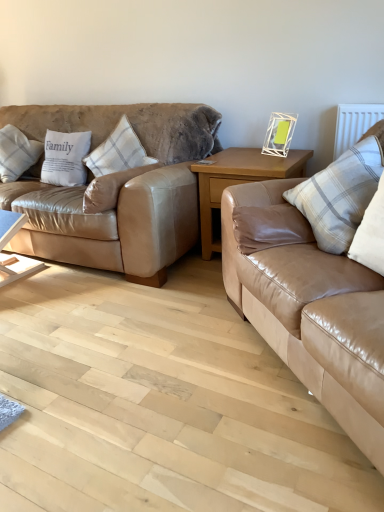
Question: Is tan leather couch at right, marked as the 2th studio couch in a left-to-right arrangement, thinner than white plaid pillow at left, which is counted as the third pillow, starting from the right?

Choices:
 (A) no
 (B) yes

Answer: (A)

Question: Would you say tan leather couch at right, marked as the 2th studio couch in a left-to-right arrangement, is outside white plaid pillow at left, the 3th pillow viewed from the left?

Choices:
 (A) no
 (B) yes

Answer: (B)

Question: Is white plaid pillow at left, the 3th pillow viewed from the left, completely or partially inside tan leather couch at right, the first studio couch positioned from the right?

Choices:
 (A) yes
 (B) no

Answer: (B)

Question: Is tan leather couch at right, marked as the 2th studio couch in a left-to-right arrangement, positioned far away from white plaid pillow at left, which is counted as the third pillow, starting from the right?

Choices:
 (A) yes
 (B) no

Answer: (A)

Question: Can you confirm if tan leather couch at right, marked as the 2th studio couch in a left-to-right arrangement, is smaller than white plaid pillow at left, the 3th pillow viewed from the left?

Choices:
 (A) no
 (B) yes

Answer: (A)

Question: Is point (200, 193) positioned closer to the camera than point (41, 150)?

Choices:
 (A) closer
 (B) farther

Answer: (A)

Question: Is light brown wooden table at center, marked as the 1th table in a right-to-left arrangement, inside the boundaries of white plaid pillow at left, placed as the first pillow when sorted from left to right, or outside?

Choices:
 (A) outside
 (B) inside

Answer: (A)

Question: Is light brown wooden table at center, placed as the 2th table when sorted from left to right, to the left or to the right of white plaid pillow at left, placed as the first pillow when sorted from left to right, in the image?

Choices:
 (A) right
 (B) left

Answer: (A)

Question: From a real-world perspective, is light brown wooden table at center, marked as the 1th table in a right-to-left arrangement, physically located above or below white plaid pillow at left, placed as the first pillow when sorted from left to right?

Choices:
 (A) below
 (B) above

Answer: (A)

Question: From a real-world perspective, is tan leather couch at right, the first studio couch positioned from the right, physically located above or below white textured radiator at upper right?

Choices:
 (A) below
 (B) above

Answer: (A)

Question: In the image, is tan leather couch at right, marked as the 2th studio couch in a left-to-right arrangement, on the left side or the right side of white textured radiator at upper right?

Choices:
 (A) right
 (B) left

Answer: (B)

Question: Is point coord(382,378) positioned closer to the camera than point coord(354,118)?

Choices:
 (A) farther
 (B) closer

Answer: (B)

Question: Relative to white textured radiator at upper right, is tan leather couch at right, marked as the 2th studio couch in a left-to-right arrangement, in front or behind?

Choices:
 (A) front
 (B) behind

Answer: (A)

Question: Is white plastic picture frame at upper right taller or shorter than white plaid pillow at left, positioned as the second pillow in right-to-left order?

Choices:
 (A) short
 (B) tall

Answer: (B)

Question: From the image's perspective, is white plastic picture frame at upper right above or below white plaid pillow at left, positioned as the second pillow in right-to-left order?

Choices:
 (A) below
 (B) above

Answer: (B)